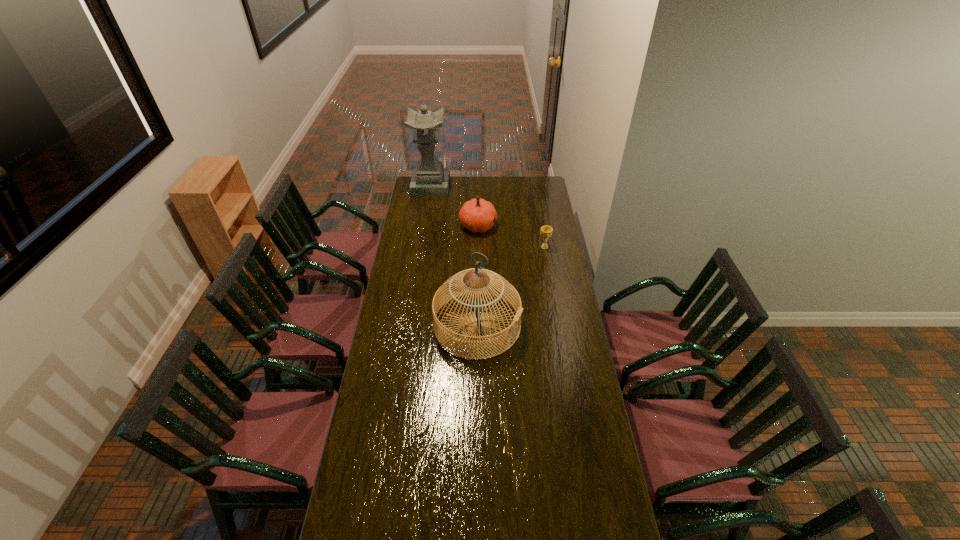
Where is `vacant region that satisfies the following two spatial constraints: 1. on the front-facing side of the pumpkin; 2. on the right side of the shortest object`? Image resolution: width=960 pixels, height=540 pixels. vacant region that satisfies the following two spatial constraints: 1. on the front-facing side of the pumpkin; 2. on the right side of the shortest object is located at coordinates (478, 247).

In order to click on free space that satisfies the following two spatial constraints: 1. on the front-facing side of the second farthest object; 2. on the right side of the chalice in this screenshot , I will do `click(478, 247)`.

The image size is (960, 540). Identify the location of vacant space that satisfies the following two spatial constraints: 1. on the back side of the birdcage; 2. at the front opening of the farthest object. (478, 187).

Locate an element on the screen. vacant area in the image that satisfies the following two spatial constraints: 1. on the front-facing side of the chalice; 2. on the right side of the second farthest object is located at coordinates (478, 247).

Where is `free spot that satisfies the following two spatial constraints: 1. on the front-facing side of the third tallest object; 2. on the right side of the chalice`? The height and width of the screenshot is (540, 960). free spot that satisfies the following two spatial constraints: 1. on the front-facing side of the third tallest object; 2. on the right side of the chalice is located at coordinates (478, 247).

I want to click on vacant space that satisfies the following two spatial constraints: 1. on the front-facing side of the third nearest object; 2. on the front side of the nearest object, so click(477, 325).